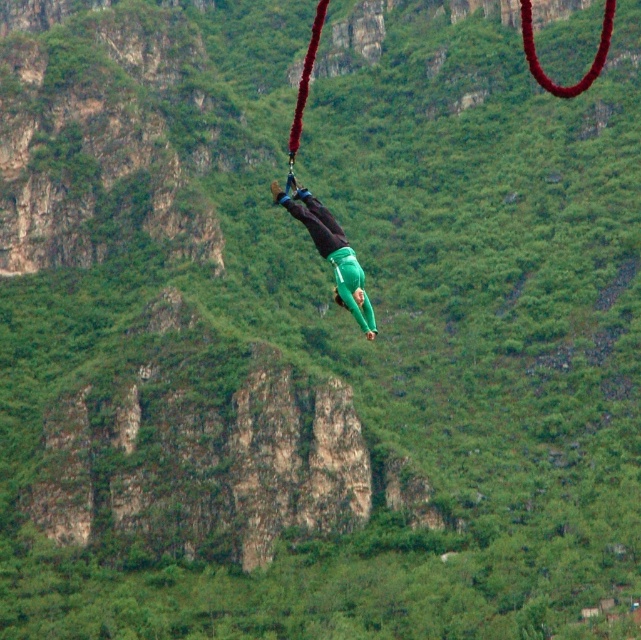
Which of these two, green fabric person at center or red fabric rope at center, stands shorter?

With less height is green fabric person at center.

In the scene shown: How much distance is there between green fabric person at center and red fabric rope at center?

29.81 meters

At what (x,y) coordinates should I click in order to perform the action: click on green fabric person at center. Please return your answer as a coordinate pair (x, y). The width and height of the screenshot is (641, 640). Looking at the image, I should click on (331, 253).

At what (x,y) coordinates should I click in order to perform the action: click on green fabric person at center. Please return your answer as a coordinate pair (x, y). The width and height of the screenshot is (641, 640). Looking at the image, I should click on (331, 253).